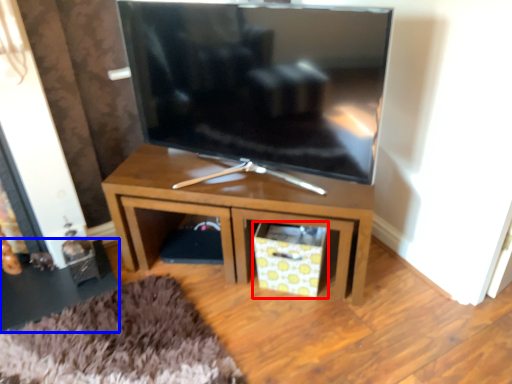
Question: Among these objects, which one is farthest to the camera, drawer (highlighted by a red box) or side table (highlighted by a blue box)?

Choices:
 (A) drawer
 (B) side table

Answer: (B)